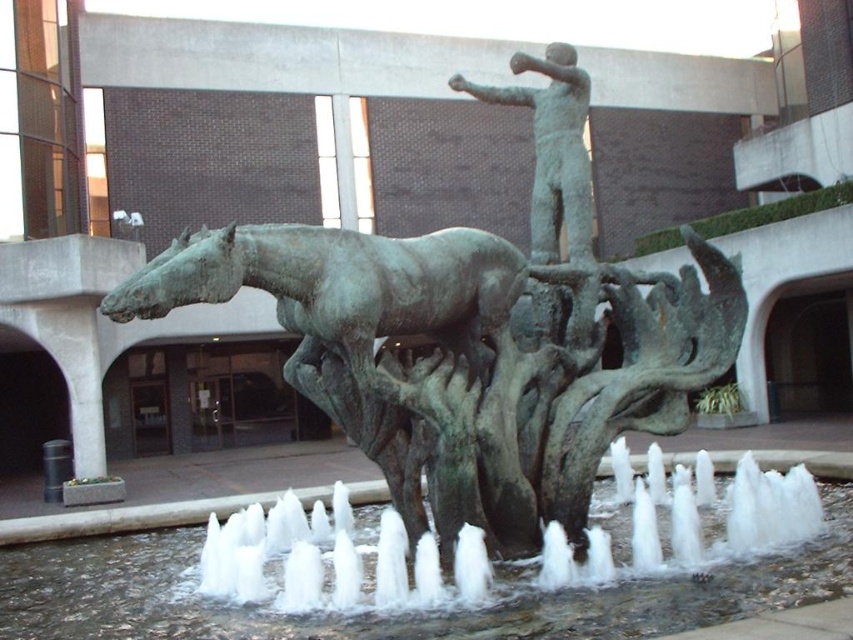
Does clear water at fountain center appear on the right side of bronze horse at center?

Correct, you'll find clear water at fountain center to the right of bronze horse at center.

Does clear water at fountain center appear over bronze horse at center?

No.

Image resolution: width=853 pixels, height=640 pixels. What do you see at coordinates (436, 564) in the screenshot?
I see `clear water at fountain center` at bounding box center [436, 564].

Find the location of `clear water at fountain center`. clear water at fountain center is located at coordinates (436, 564).

The width and height of the screenshot is (853, 640). Identify the location of bronze statue at center. (477, 336).

Can you confirm if bronze statue at center is bigger than clear water at fountain center?

Indeed, bronze statue at center has a larger size compared to clear water at fountain center.

Where is `bronze statue at center`? bronze statue at center is located at coordinates (477, 336).

Can you confirm if bronze horse at center is shorter than bronze figure at center?

Yes, bronze horse at center is shorter than bronze figure at center.

Can you confirm if bronze horse at center is positioned to the right of bronze figure at center?

In fact, bronze horse at center is to the left of bronze figure at center.

Describe the element at coordinates (340, 284) in the screenshot. This screenshot has height=640, width=853. I see `bronze horse at center` at that location.

Find the location of a particular element. This screenshot has height=640, width=853. bronze horse at center is located at coordinates (340, 284).